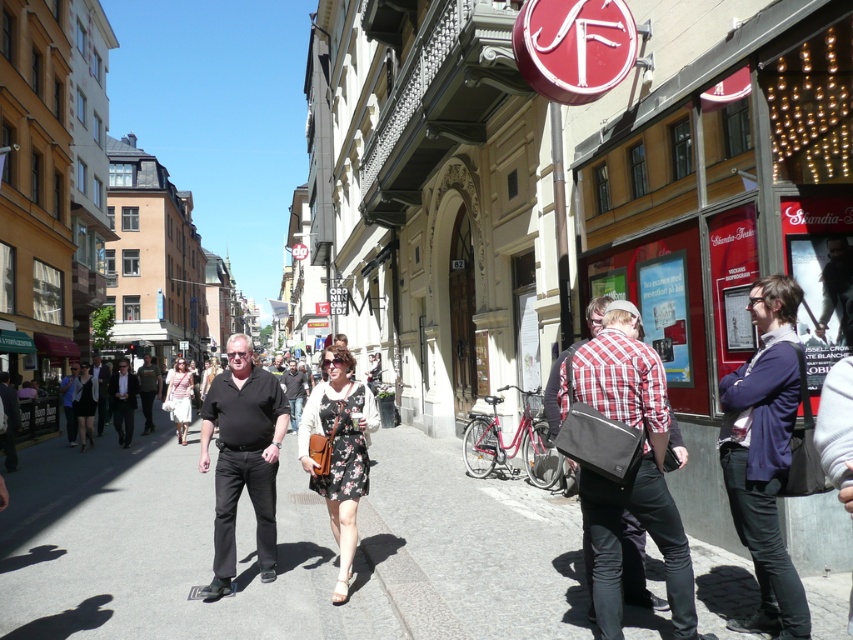
Can you confirm if red checkered shirt at center is wider than black matte shirt at center?

Correct, the width of red checkered shirt at center exceeds that of black matte shirt at center.

Which is in front, point (618, 572) or point (279, 422)?

Positioned in front is point (618, 572).

Who is more distant from viewer, (627, 300) or (218, 584)?

Positioned behind is point (627, 300).

Locate an element on the screen. The height and width of the screenshot is (640, 853). red checkered shirt at center is located at coordinates (635, 472).

Which of these two, red checkered shirt at center or dark gray shirt at center, stands taller?

dark gray shirt at center

Is red checkered shirt at center closer to the viewer compared to dark gray shirt at center?

That is True.

The image size is (853, 640). Find the location of `red checkered shirt at center`. red checkered shirt at center is located at coordinates (635, 472).

Is black matte shirt at center taller than dark gray cotton shirt at center?

No, black matte shirt at center is not taller than dark gray cotton shirt at center.

Consider the image. Does black matte shirt at center come in front of dark gray cotton shirt at center?

Yes, black matte shirt at center is in front of dark gray cotton shirt at center.

You are a GUI agent. You are given a task and a screenshot of the screen. Output one action in this format:
    pyautogui.click(x=<x>, y=<y>)
    Task: Click on the black matte shirt at center
    Image resolution: width=853 pixels, height=640 pixels.
    Given the screenshot: What is the action you would take?
    pyautogui.click(x=242, y=458)